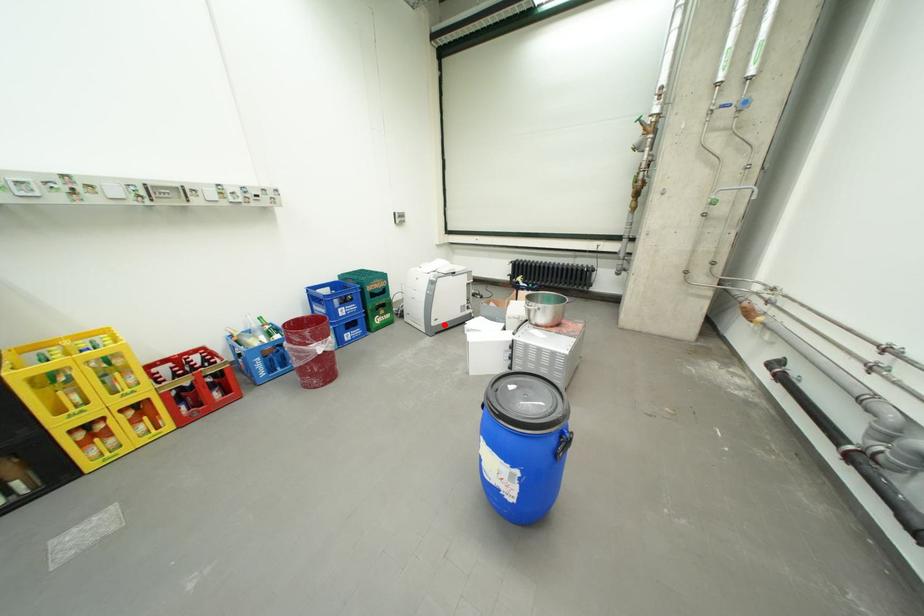
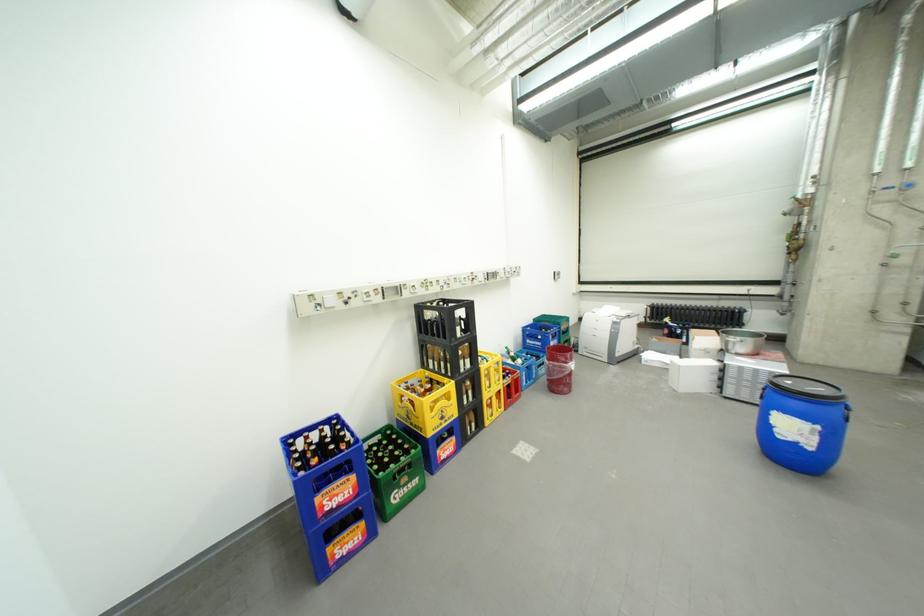
Question: I am providing you with two images of the same scene from different viewpoints. A red point is shown in image1. For the corresponding object point in image2, is it positioned nearer or farther from the camera?

Choices:
 (A) Nearer
 (B) Farther

Answer: (A)